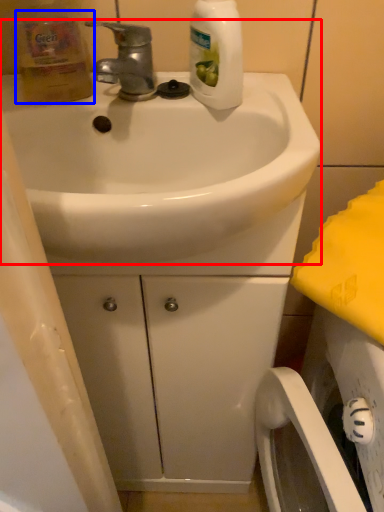
Question: Which of the following is the closest to the observer, sink (highlighted by a red box) or cleaning product (highlighted by a blue box)?

Choices:
 (A) sink
 (B) cleaning product

Answer: (A)